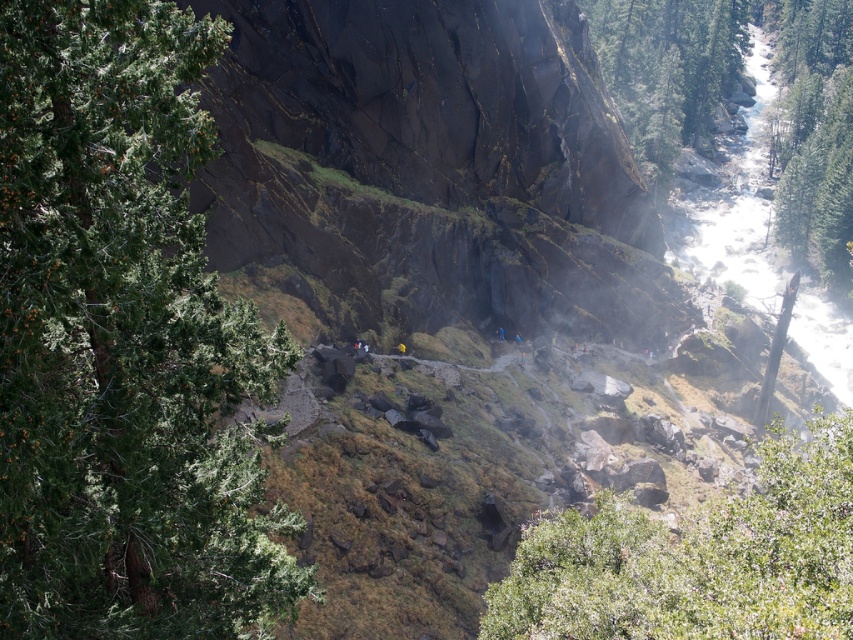
Does green leafy tree at left lie behind green leafy tree at lower right?

No, green leafy tree at left is in front of green leafy tree at lower right.

Between green leafy tree at left and green leafy tree at lower right, which one is positioned higher?

green leafy tree at left

The image size is (853, 640). In order to click on green leafy tree at left in this screenshot , I will do `click(123, 342)`.

Is green leafy tree at lower right wider than green textured tree at right?

No, green leafy tree at lower right is not wider than green textured tree at right.

Between green leafy tree at lower right and green textured tree at right, which one has less height?

green leafy tree at lower right is shorter.

Where is `green leafy tree at lower right`? The height and width of the screenshot is (640, 853). green leafy tree at lower right is located at coordinates (697, 560).

Can you confirm if green leafy tree at left is positioned to the right of green textured tree at right?

Incorrect, green leafy tree at left is not on the right side of green textured tree at right.

Can you confirm if green leafy tree at left is positioned above green textured tree at right?

No.

The height and width of the screenshot is (640, 853). I want to click on green leafy tree at left, so click(x=123, y=342).